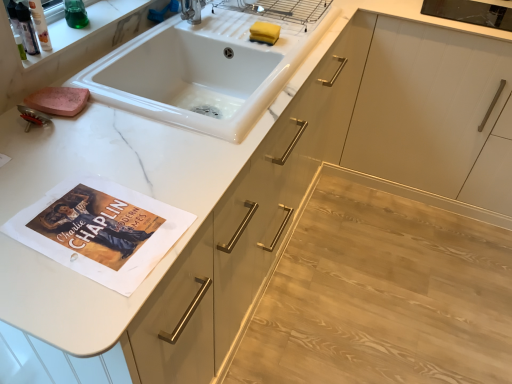
Question: Is white glossy sink at upper center at the left side of white marble shelf at upper left?

Choices:
 (A) no
 (B) yes

Answer: (A)

Question: Is white glossy sink at upper center further to the viewer compared to white marble shelf at upper left?

Choices:
 (A) no
 (B) yes

Answer: (A)

Question: From the image's perspective, is white glossy sink at upper center beneath white marble shelf at upper left?

Choices:
 (A) no
 (B) yes

Answer: (B)

Question: Is white glossy sink at upper center smaller than white marble shelf at upper left?

Choices:
 (A) no
 (B) yes

Answer: (A)

Question: Is white marble shelf at upper left a part of white glossy sink at upper center?

Choices:
 (A) yes
 (B) no

Answer: (B)

Question: Considering the positions of point (90, 77) and point (384, 296), is point (90, 77) closer or farther from the camera than point (384, 296)?

Choices:
 (A) farther
 (B) closer

Answer: (B)

Question: Do you think white glossy sink at upper center is within light wood floor at lower right, or outside of it?

Choices:
 (A) inside
 (B) outside

Answer: (B)

Question: Considering the positions of white glossy sink at upper center and light wood floor at lower right in the image, is white glossy sink at upper center wider or thinner than light wood floor at lower right?

Choices:
 (A) thin
 (B) wide

Answer: (A)

Question: In terms of height, does white glossy sink at upper center look taller or shorter compared to light wood floor at lower right?

Choices:
 (A) tall
 (B) short

Answer: (A)

Question: From a real-world perspective, is yellow sponge at sink positioned above or below white glossy sink at upper center?

Choices:
 (A) below
 (B) above

Answer: (B)

Question: From their relative heights in the image, would you say yellow sponge at sink is taller or shorter than white glossy sink at upper center?

Choices:
 (A) short
 (B) tall

Answer: (A)

Question: In terms of size, does yellow sponge at sink appear bigger or smaller than white glossy sink at upper center?

Choices:
 (A) big
 (B) small

Answer: (B)

Question: Is point click(259, 39) closer or farther from the camera than point click(92, 94)?

Choices:
 (A) farther
 (B) closer

Answer: (A)

Question: Does point (234, 92) appear closer or farther from the camera than point (267, 26)?

Choices:
 (A) closer
 (B) farther

Answer: (B)

Question: Considering their positions, is white glossy sink at upper center located in front of or behind yellow sponge at sink?

Choices:
 (A) front
 (B) behind

Answer: (A)